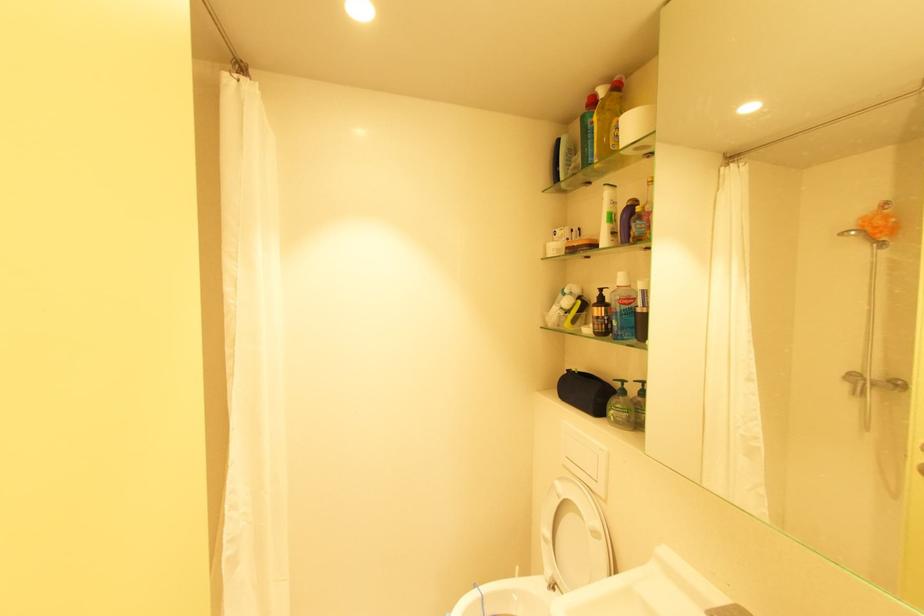
The image size is (924, 616). In order to click on white flush button in this screenshot , I will do `click(582, 453)`.